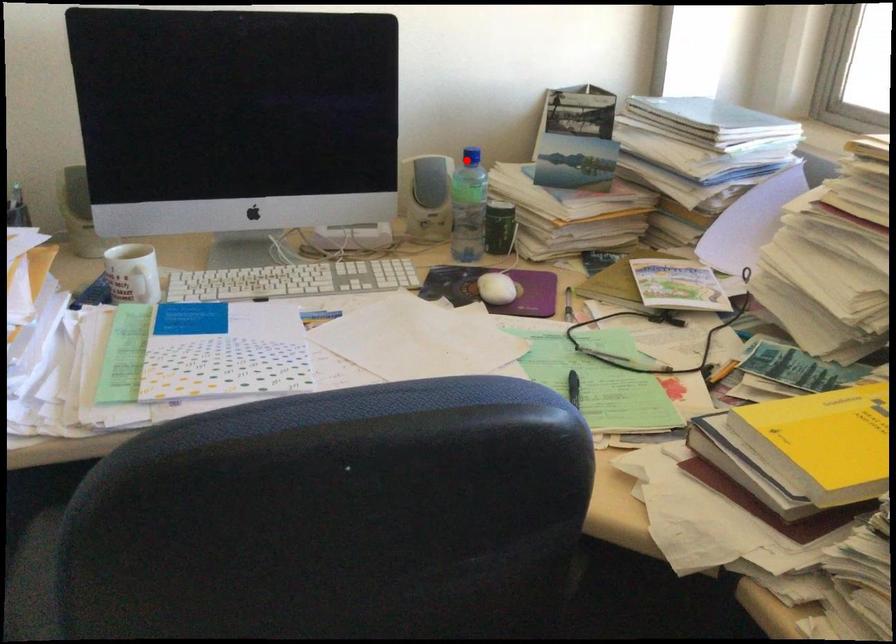
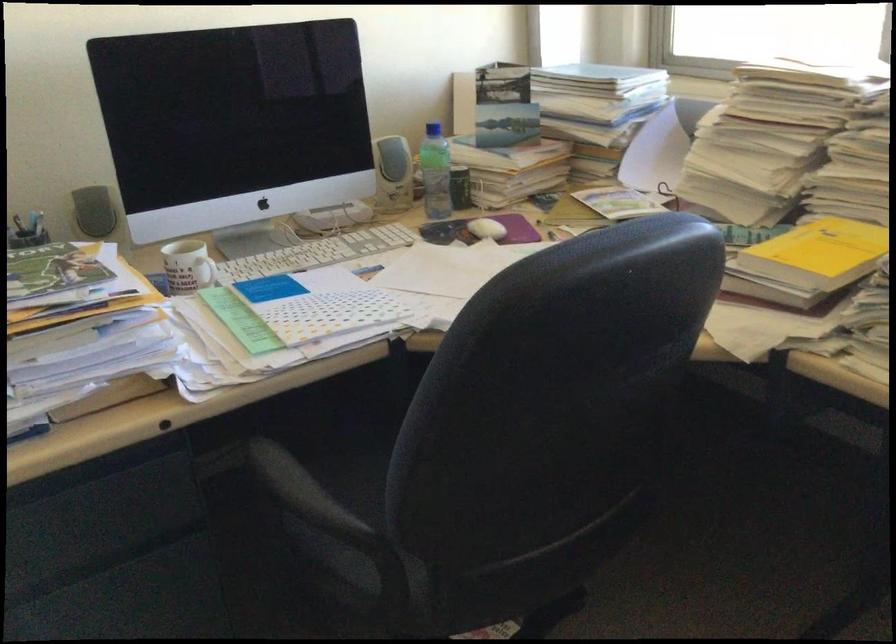
Question: I am providing you with two images of the same scene from different viewpoints. In image1, a red point is highlighted. Considering the same 3D point in image2, which of the following is correct?

Choices:
 (A) It is closer
 (B) It is farther

Answer: (B)